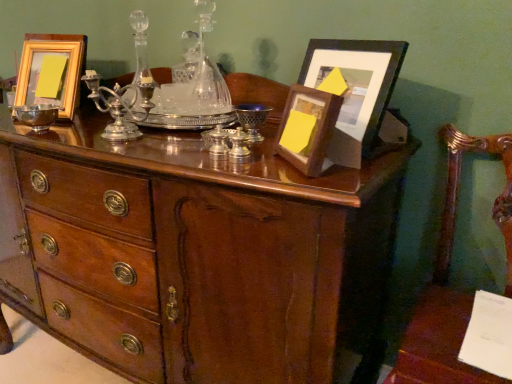
This screenshot has width=512, height=384. Identify the location of vacant space situated on the left part of shiny silver candle holder at center, the first candle holder viewed from the front. tap(168, 156).